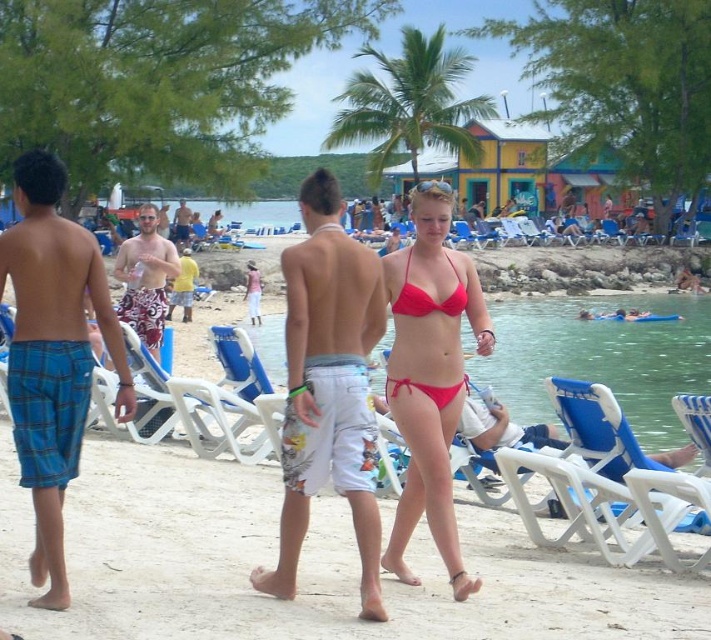
Question: Does white printed shorts at center have a smaller size compared to matte red bikini at center?

Choices:
 (A) no
 (B) yes

Answer: (A)

Question: Which point is closer to the camera?

Choices:
 (A) matte white surfboard at center
 (B) matte red bikini at center
 (C) blue plaid shorts at left
 (D) red matte bikini at center

Answer: (C)

Question: Which object is positioned closest to the matte red bikini top at center?

Choices:
 (A) matte white surfboard at center
 (B) white printed shorts at center
 (C) blue plaid shorts at left

Answer: (B)

Question: Where is blue plastic beach chair at lower right located in relation to matte red bikini top at center in the image?

Choices:
 (A) above
 (B) below

Answer: (B)

Question: Can you confirm if blue plastic beach chair at lower right is positioned below matte red bikini at center?

Choices:
 (A) no
 (B) yes

Answer: (B)

Question: Which object is the closest to the red matte bikini at center?

Choices:
 (A) white printed shorts at center
 (B) matte white surfboard at center
 (C) blue plastic beach chair at lower right

Answer: (A)